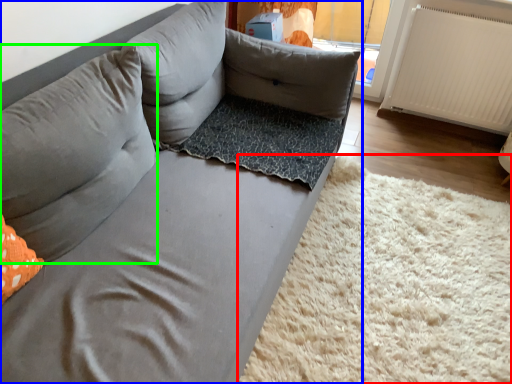
Question: Estimate the real-world distances between objects in this image. Which object is closer to mat (highlighted by a red box), studio couch (highlighted by a blue box) or pillow (highlighted by a green box)?

Choices:
 (A) studio couch
 (B) pillow

Answer: (A)